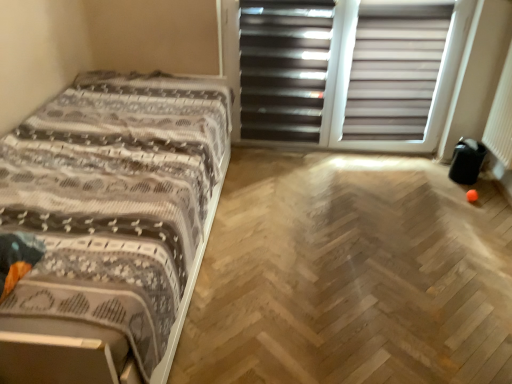
Question: Is patterned fabric bed at left further to camera compared to white plastic blinds at upper center, arranged as the first screen door when viewed from the right?

Choices:
 (A) yes
 (B) no

Answer: (B)

Question: Can you confirm if patterned fabric bed at left is positioned to the right of white plastic blinds at upper center, the 2th screen door when ordered from left to right?

Choices:
 (A) yes
 (B) no

Answer: (B)

Question: Considering the relative sizes of patterned fabric bed at left and white plastic blinds at upper center, arranged as the first screen door when viewed from the right, in the image provided, is patterned fabric bed at left smaller than white plastic blinds at upper center, arranged as the first screen door when viewed from the right,?

Choices:
 (A) yes
 (B) no

Answer: (B)

Question: Is patterned fabric bed at left positioned beyond the bounds of white plastic blinds at upper center, the 2th screen door when ordered from left to right?

Choices:
 (A) no
 (B) yes

Answer: (B)

Question: From the image's perspective, does patterned fabric bed at left appear higher than white plastic blinds at upper center, the 2th screen door when ordered from left to right?

Choices:
 (A) yes
 (B) no

Answer: (B)

Question: Is the position of patterned fabric bed at left less distant than that of white plastic blinds at upper center, arranged as the first screen door when viewed from the right?

Choices:
 (A) yes
 (B) no

Answer: (A)

Question: Considering the relative sizes of matte white blinds at upper right and white plastic blinds at upper center, the 2th screen door when ordered from left to right, in the image provided, is matte white blinds at upper right thinner than white plastic blinds at upper center, the 2th screen door when ordered from left to right,?

Choices:
 (A) no
 (B) yes

Answer: (A)

Question: Is matte white blinds at upper right smaller than white plastic blinds at upper center, arranged as the first screen door when viewed from the right?

Choices:
 (A) no
 (B) yes

Answer: (B)

Question: Can you confirm if matte white blinds at upper right is taller than white plastic blinds at upper center, arranged as the first screen door when viewed from the right?

Choices:
 (A) no
 (B) yes

Answer: (A)

Question: Is white plastic blinds at upper center, the 2th screen door when ordered from left to right, at the back of matte white blinds at upper right?

Choices:
 (A) no
 (B) yes

Answer: (B)

Question: Is matte white blinds at upper right beside white plastic blinds at upper center, arranged as the first screen door when viewed from the right?

Choices:
 (A) yes
 (B) no

Answer: (B)

Question: Is matte white blinds at upper right positioned before white plastic blinds at upper center, arranged as the first screen door when viewed from the right?

Choices:
 (A) no
 (B) yes

Answer: (B)

Question: From the image's perspective, is matte white blinds at upper right under black matte screen door at upper center, the 1th screen door positioned from the left?

Choices:
 (A) yes
 (B) no

Answer: (A)